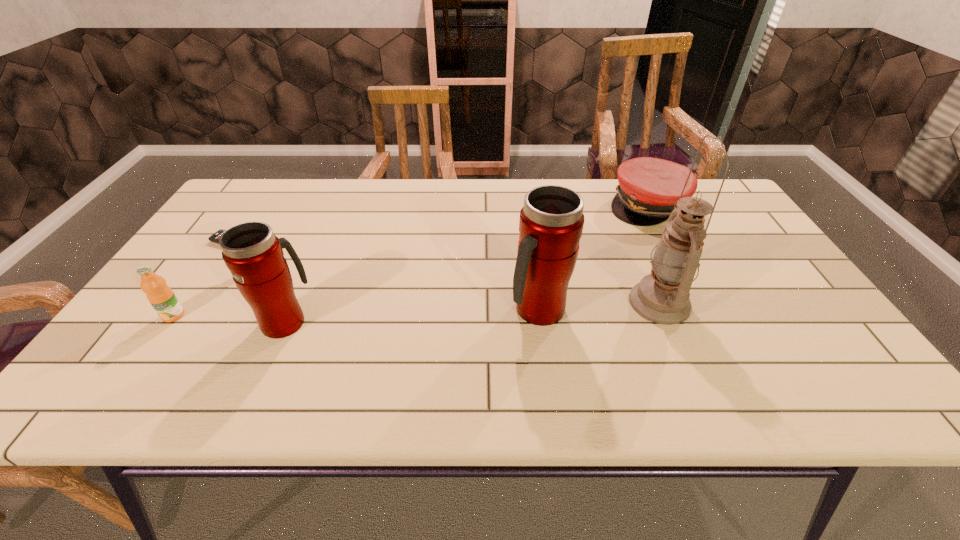
You are a GUI agent. You are given a task and a screenshot of the screen. Output one action in this format:
    pyautogui.click(x=<x>, y=<y>)
    Task: Click on the third tallest object
    The width and height of the screenshot is (960, 540).
    Given the screenshot: What is the action you would take?
    pyautogui.click(x=254, y=255)

Locate an element on the screen. Image resolution: width=960 pixels, height=540 pixels. the fourth object from right to left is located at coordinates (254, 255).

Locate an element on the screen. The image size is (960, 540). the taller thermos bottle is located at coordinates (551, 222).

Where is `the fifth shortest object`? Image resolution: width=960 pixels, height=540 pixels. the fifth shortest object is located at coordinates (551, 222).

Locate an element on the screen. Image resolution: width=960 pixels, height=540 pixels. the farthest object is located at coordinates (649, 188).

Identify the location of the fifth tallest object. (649, 188).

I want to click on oil lamp, so click(x=662, y=297).

This screenshot has width=960, height=540. Find the location of `remote control`. remote control is located at coordinates (215, 237).

Locate an element on the screen. The height and width of the screenshot is (540, 960). the shortest object is located at coordinates (215, 237).

The image size is (960, 540). What are the coordinates of `orange juice` in the screenshot? It's located at (161, 297).